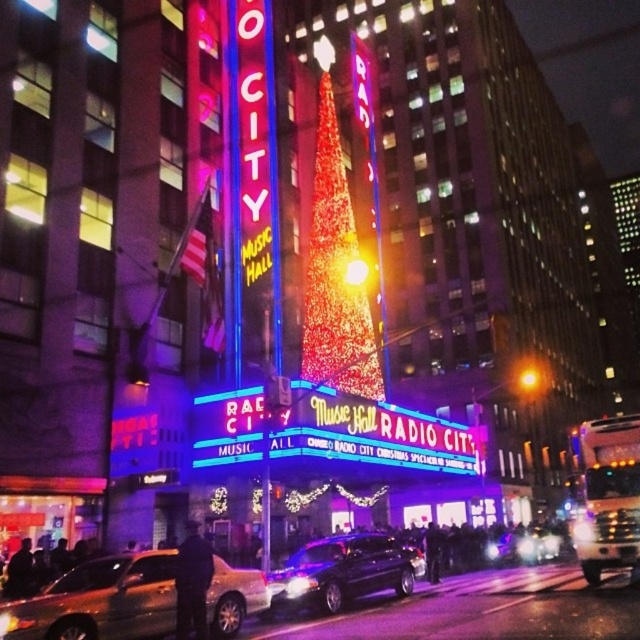
Question: Which of the following is the closest to the observer?

Choices:
 (A) gold metallic car at lower left
 (B) metallic silver car at center
 (C) shiny black sedan at center

Answer: (A)

Question: Can you confirm if gold metallic car at lower left is bigger than shiny black sedan at center?

Choices:
 (A) yes
 (B) no

Answer: (B)

Question: Does shiny black sedan at center have a larger size compared to metallic silver car at center?

Choices:
 (A) no
 (B) yes

Answer: (A)

Question: Is gold metallic car at lower left wider than shiny black sedan at center?

Choices:
 (A) no
 (B) yes

Answer: (B)

Question: Which point is farther to the camera?

Choices:
 (A) (522, 538)
 (B) (342, 563)

Answer: (A)

Question: Estimate the real-world distances between objects in this image. Which object is farther from the metallic silver car at center?

Choices:
 (A) shiny black sedan at center
 (B) gold metallic car at lower left

Answer: (B)